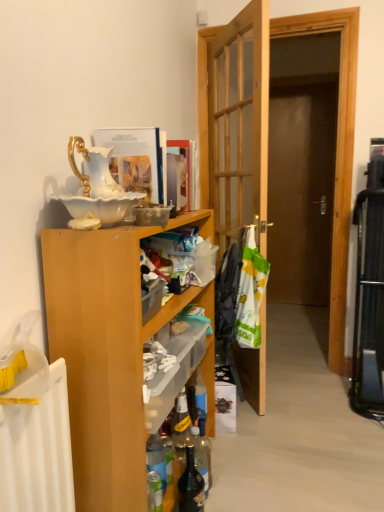
Question: Is wooden door at center shorter than dark glass bottle at lower center, which is the 1th bottle in right-to-left order?

Choices:
 (A) no
 (B) yes

Answer: (A)

Question: Is dark glass bottle at lower center, which is the 1th bottle in right-to-left order, at the back of wooden door at center?

Choices:
 (A) no
 (B) yes

Answer: (A)

Question: Considering the relative sizes of wooden door at center and dark glass bottle at lower center, positioned as the 2th bottle in left-to-right order, in the image provided, is wooden door at center taller than dark glass bottle at lower center, positioned as the 2th bottle in left-to-right order,?

Choices:
 (A) yes
 (B) no

Answer: (A)

Question: From a real-world perspective, is wooden door at center on top of dark glass bottle at lower center, which is the 1th bottle in right-to-left order?

Choices:
 (A) no
 (B) yes

Answer: (B)

Question: Is wooden door at center at the left side of dark glass bottle at lower center, positioned as the 2th bottle in left-to-right order?

Choices:
 (A) no
 (B) yes

Answer: (A)

Question: Does wooden door at center turn towards dark glass bottle at lower center, which is the 1th bottle in right-to-left order?

Choices:
 (A) yes
 (B) no

Answer: (B)

Question: Considering the relative sizes of wooden cabinet at left and white plastic laundry at center, the first laundry viewed from the back, in the image provided, is wooden cabinet at left smaller than white plastic laundry at center, the first laundry viewed from the back,?

Choices:
 (A) no
 (B) yes

Answer: (A)

Question: Is wooden cabinet at left far from white plastic laundry at center, the first laundry viewed from the back?

Choices:
 (A) no
 (B) yes

Answer: (A)

Question: Considering the relative positions of wooden cabinet at left and white plastic laundry at center, the first laundry viewed from the back, in the image provided, is wooden cabinet at left to the left of white plastic laundry at center, the first laundry viewed from the back, from the viewer's perspective?

Choices:
 (A) yes
 (B) no

Answer: (A)

Question: From the image's perspective, is wooden cabinet at left on white plastic laundry at center, which ranks as the second laundry in front-to-back order?

Choices:
 (A) no
 (B) yes

Answer: (A)

Question: From the image's perspective, is wooden cabinet at left located beneath white plastic laundry at center, which ranks as the second laundry in front-to-back order?

Choices:
 (A) no
 (B) yes

Answer: (B)

Question: Can you confirm if wooden cabinet at left is bigger than white plastic laundry at center, the first laundry viewed from the back?

Choices:
 (A) yes
 (B) no

Answer: (A)

Question: Is dark glass bottle at lower center, positioned as the 2th bottle in left-to-right order, completely or partially inside translucent glass bottle at lower center, marked as the second bottle in a right-to-left arrangement?

Choices:
 (A) yes
 (B) no

Answer: (B)